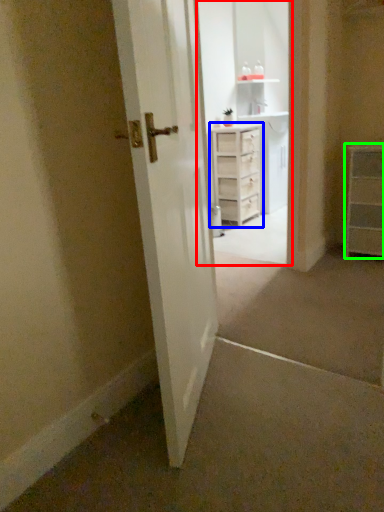
Question: Which is farther away from entertainment center (highlighted by a red box)? chest of drawers (highlighted by a blue box) or chest of drawers (highlighted by a green box)?

Choices:
 (A) chest of drawers
 (B) chest of drawers

Answer: (B)